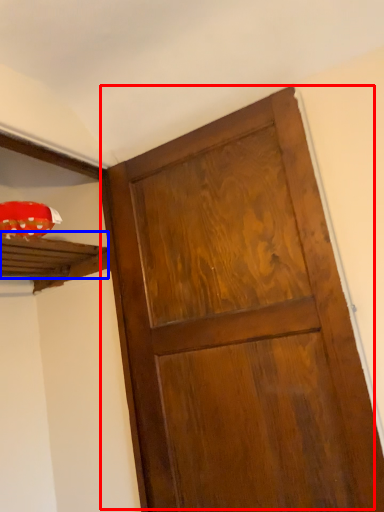
Question: Which object is closer to the camera taking this photo, door (highlighted by a red box) or shelf (highlighted by a blue box)?

Choices:
 (A) door
 (B) shelf

Answer: (A)